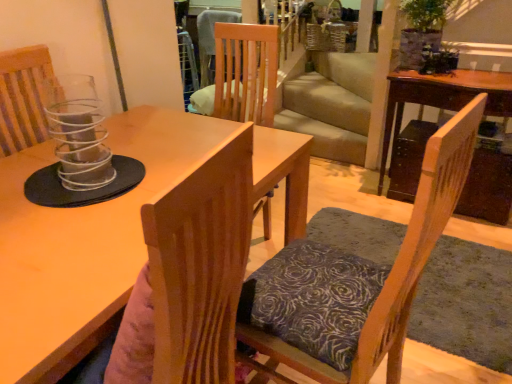
Question: Is wooden table at right, arranged as the second table when viewed from the left, oriented towards wooden chair with patterned cushion at center, the 2th chair from the left?

Choices:
 (A) no
 (B) yes

Answer: (B)

Question: Is wooden table at right, which is the first table from right to left, to the right of wooden chair with patterned cushion at center, the 1th chair when ordered from right to left, from the viewer's perspective?

Choices:
 (A) yes
 (B) no

Answer: (A)

Question: Can you confirm if wooden table at right, which is the first table from right to left, is wider than wooden chair with patterned cushion at center, the 2th chair from the left?

Choices:
 (A) no
 (B) yes

Answer: (A)

Question: From a real-world perspective, is wooden table at right, arranged as the second table when viewed from the left, beneath wooden chair with patterned cushion at center, the 2th chair from the left?

Choices:
 (A) no
 (B) yes

Answer: (B)

Question: Is wooden chair with patterned cushion at center, the 2th chair from the left, at the back of wooden table at right, which appears as the first table when viewed from the back?

Choices:
 (A) yes
 (B) no

Answer: (B)

Question: Can you confirm if wooden table at right, which appears as the first table when viewed from the back, is bigger than wooden chair with patterned cushion at center, the 1th chair when ordered from right to left?

Choices:
 (A) no
 (B) yes

Answer: (B)

Question: Is matte wooden table at center, which is the second table from back to front, outside wooden chair with patterned cushion at center, the 1th chair when ordered from right to left?

Choices:
 (A) no
 (B) yes

Answer: (B)

Question: Can you confirm if matte wooden table at center, which ranks as the first table in front-to-back order, is taller than wooden chair with patterned cushion at center, the 1th chair when ordered from right to left?

Choices:
 (A) yes
 (B) no

Answer: (B)

Question: Can you confirm if matte wooden table at center, which is the second table from back to front, is wider than wooden chair with patterned cushion at center, the 2th chair from the left?

Choices:
 (A) no
 (B) yes

Answer: (A)

Question: Is wooden chair with patterned cushion at center, the 1th chair when ordered from right to left, completely or partially inside matte wooden table at center, which ranks as the first table in front-to-back order?

Choices:
 (A) no
 (B) yes

Answer: (A)

Question: Does matte wooden table at center, which is the second table from back to front, appear on the right side of wooden chair with patterned cushion at center, the 2th chair from the left?

Choices:
 (A) yes
 (B) no

Answer: (B)

Question: Is matte wooden table at center, which is the second table from back to front, thinner than wooden chair with patterned cushion at center, the 1th chair when ordered from right to left?

Choices:
 (A) yes
 (B) no

Answer: (A)

Question: Can you confirm if wooden chair with patterned cushion at center, the 2th chair from the left, is wider than matte wooden table at center, the 2th table from the right?

Choices:
 (A) yes
 (B) no

Answer: (A)